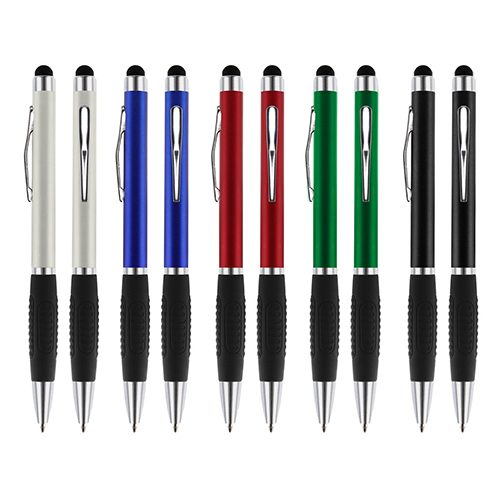
You are a GUI agent. You are given a task and a screenshot of the screen. Output one action in this format:
    pyautogui.click(x=<x>, y=<y>)
    Task: Click on the pens
    The image size is (500, 500).
    Given the screenshot: What is the action you would take?
    pyautogui.click(x=30, y=193), pyautogui.click(x=77, y=204), pyautogui.click(x=127, y=208), pyautogui.click(x=174, y=217), pyautogui.click(x=236, y=226), pyautogui.click(x=265, y=229), pyautogui.click(x=322, y=238), pyautogui.click(x=369, y=244), pyautogui.click(x=425, y=244), pyautogui.click(x=463, y=244)